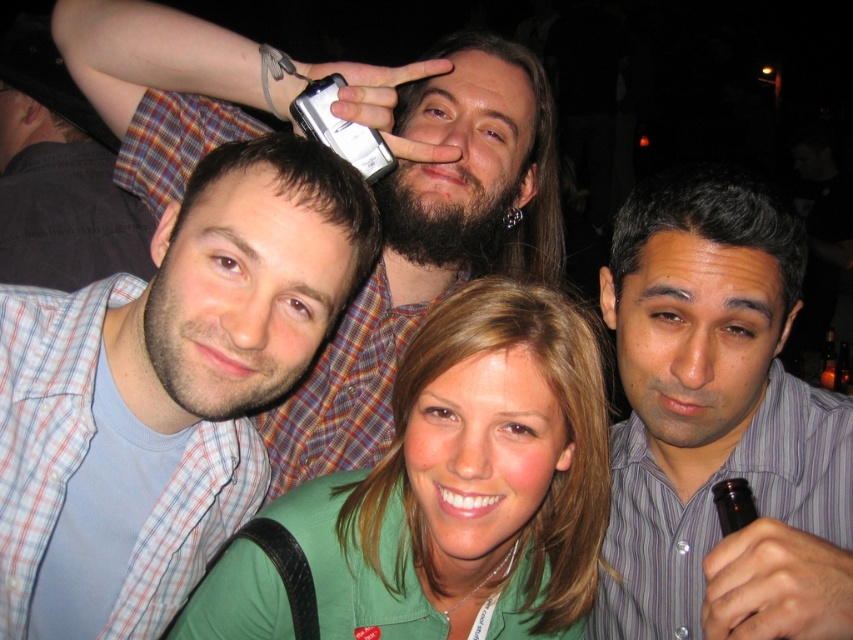
Question: Which point is farther to the camera?

Choices:
 (A) green fabric shirt at center
 (B) striped button-up shirt at right
 (C) matte blue shirt at center

Answer: (C)

Question: Does striped button-up shirt at right have a smaller size compared to plaid shirt at upper left?

Choices:
 (A) yes
 (B) no

Answer: (A)

Question: Which point is farther from the camera taking this photo?

Choices:
 (A) (74, 118)
 (B) (486, 182)

Answer: (A)

Question: Does striped button-up shirt at right come behind plaid shirt at upper left?

Choices:
 (A) no
 (B) yes

Answer: (A)

Question: Does striped button-up shirt at right appear on the right side of green fabric shirt at center?

Choices:
 (A) no
 (B) yes

Answer: (B)

Question: Which point appears closest to the camera in this image?

Choices:
 (A) (38, 99)
 (B) (102, 592)

Answer: (B)